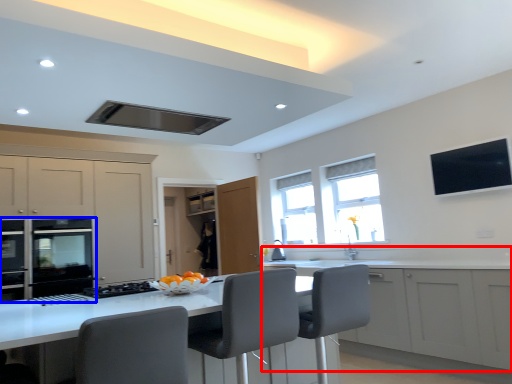
Question: Which object appears closest to the camera in this image, cabinetry (highlighted by a red box) or home appliance (highlighted by a blue box)?

Choices:
 (A) cabinetry
 (B) home appliance

Answer: (A)